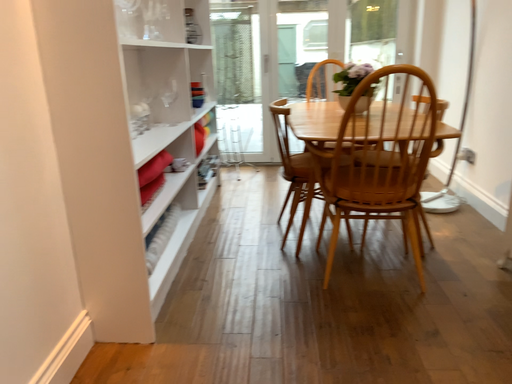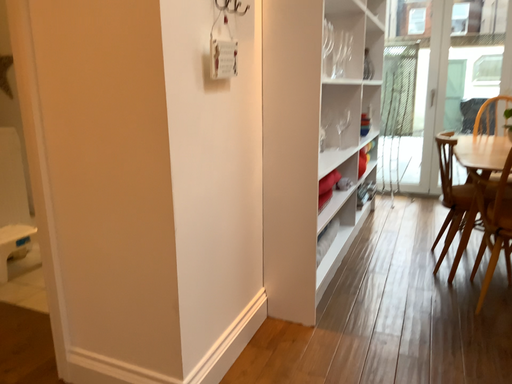
Question: Which way did the camera rotate in the video?

Choices:
 (A) rotated right
 (B) rotated left

Answer: (B)